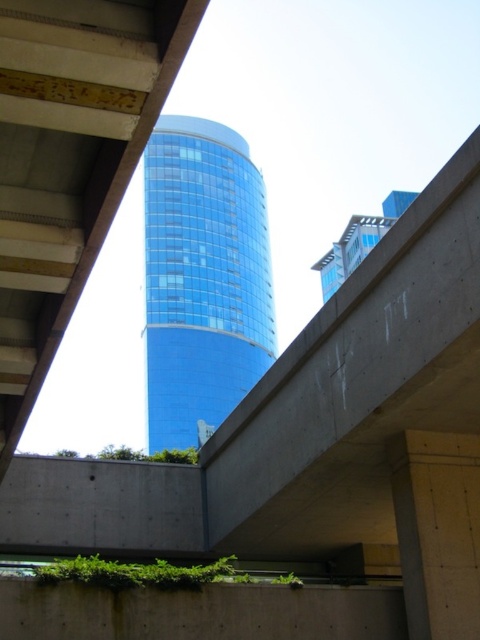
Can you confirm if blue glassy tower at center is positioned to the right of concrete at center?

No, blue glassy tower at center is not to the right of concrete at center.

Who is lower down, blue glassy tower at center or concrete at center?

concrete at center is below.

Is point (151, 282) positioned behind point (458, 461)?

That is True.

Identify the location of blue glassy tower at center. (203, 276).